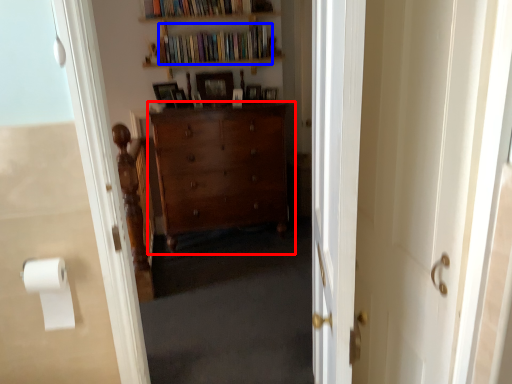
Question: Among these objects, which one is farthest to the camera, cabinetry (highlighted by a red box) or book (highlighted by a blue box)?

Choices:
 (A) cabinetry
 (B) book

Answer: (B)